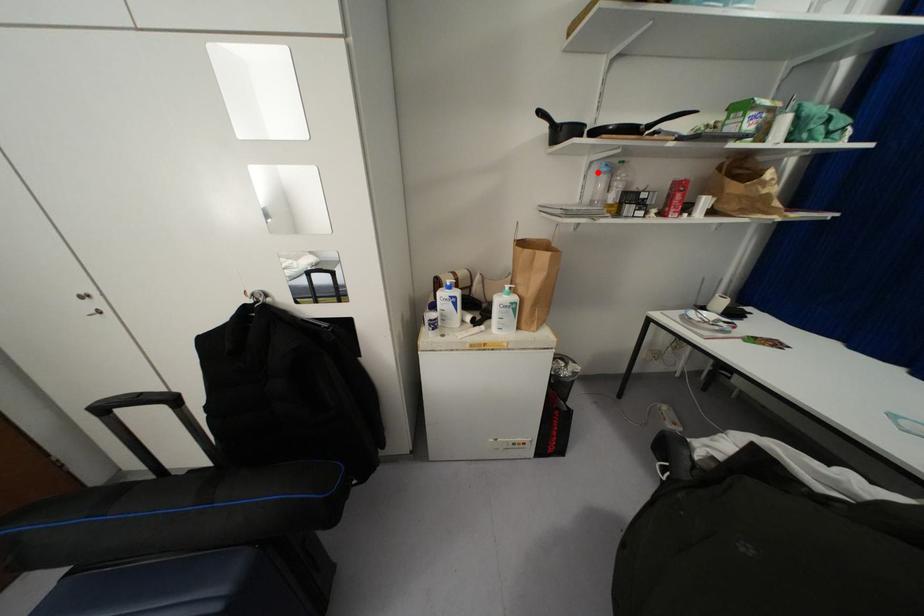
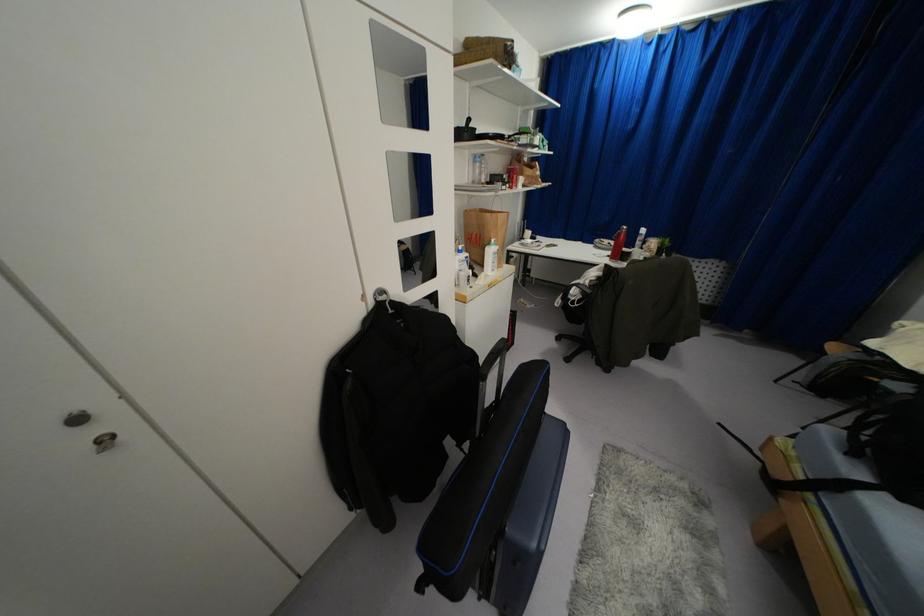
Locate, in the second image, the point that corresponds to the highlighted location in the first image.

(475, 161)